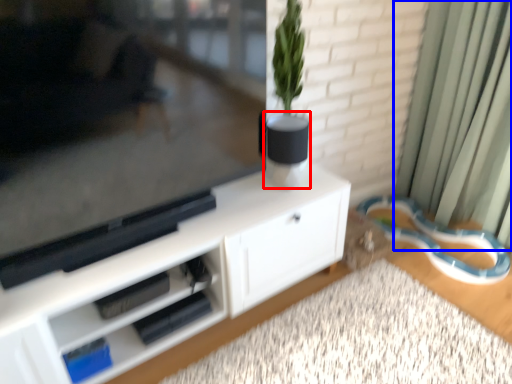
Question: Among these objects, which one is nearest to the camera, vase (highlighted by a red box) or curtain (highlighted by a blue box)?

Choices:
 (A) vase
 (B) curtain

Answer: (B)